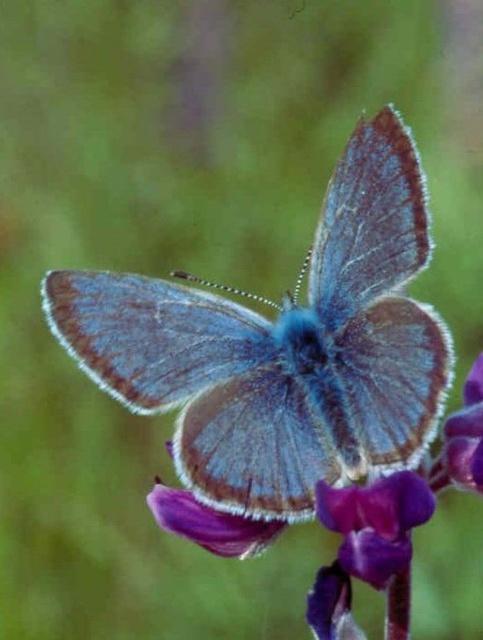
You are a gardener who wants to gently remove the fuzzy blue butterfly at center from the purple velvet flower at center without harming it. What is the minimum distance you should maintain between your hand and the flower to avoid startling the butterfly?

The fuzzy blue butterfly at center and the purple velvet flower at center are 23.16 centimeters apart. To avoid startling the butterfly, you should maintain a distance of at least 23.16 centimeters between your hand and the flower.

You are an entomologist studying the positioning of insects in their habitats. Based on the image, what are the exact coordinates of the fuzzy blue butterfly at center?

The fuzzy blue butterfly at center is located at the 2D coordinates of point (284, 348).

You are a gardener holding a net to catch the fuzzy blue butterfly at center. The net is 4 feet long. Can you reach the butterfly without moving closer?

The fuzzy blue butterfly at center is 4.60 feet away from you. Since the net is only 4 feet long, you cannot reach it without moving closer.